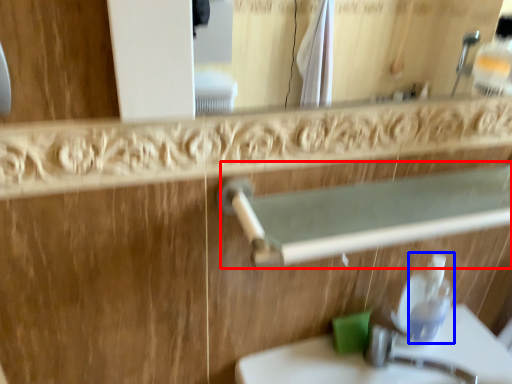
Question: Which of the following is the closest to the observer, balustrade (highlighted by a red box) or soap dispenser (highlighted by a blue box)?

Choices:
 (A) balustrade
 (B) soap dispenser

Answer: (A)